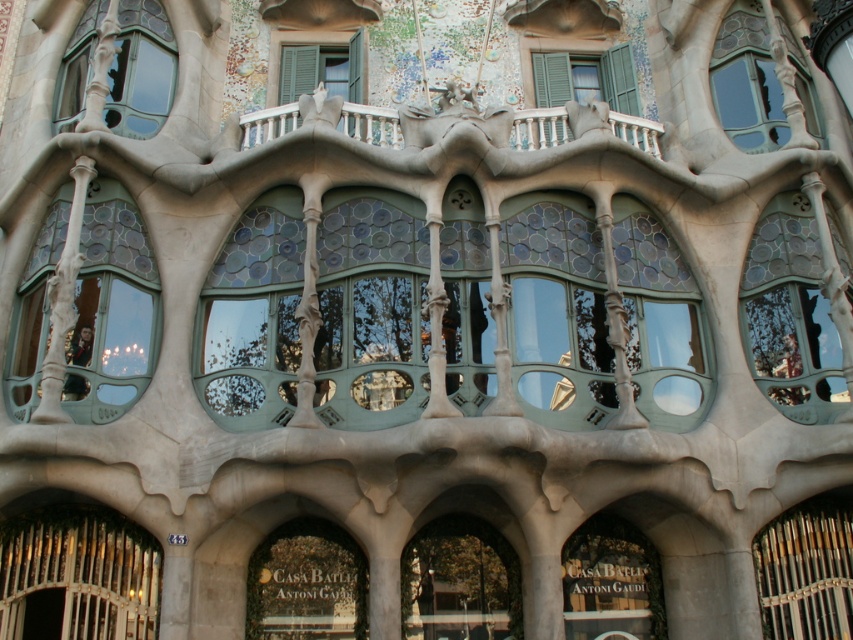
Does green glass window at center have a smaller size compared to matte gray stone at upper center?

Yes.

Which is behind, point (654, 577) or point (328, 54)?

The point (328, 54) is more distant.

The width and height of the screenshot is (853, 640). I want to click on green glass window at center, so click(611, 582).

Who is higher up, translucent glass window at upper left or matte gray stone at upper center?

translucent glass window at upper left is higher up.

Can you confirm if translucent glass window at upper left is taller than matte gray stone at upper center?

Yes, translucent glass window at upper left is taller than matte gray stone at upper center.

I want to click on translucent glass window at upper left, so click(140, 68).

Image resolution: width=853 pixels, height=640 pixels. In order to click on translucent glass window at upper left in this screenshot , I will do `click(140, 68)`.

Between transparent glass window at upper right and green matte shutters at upper center, which one is positioned lower?

transparent glass window at upper right

Does point (757, 52) come in front of point (579, 90)?

Yes, it is.

You are a GUI agent. You are given a task and a screenshot of the screen. Output one action in this format:
    pyautogui.click(x=<x>, y=<y>)
    Task: Click on the transparent glass window at upper right
    The image size is (853, 640).
    Given the screenshot: What is the action you would take?
    pyautogui.click(x=750, y=100)

Where is `transparent glass window at upper right`? transparent glass window at upper right is located at coordinates (750, 100).